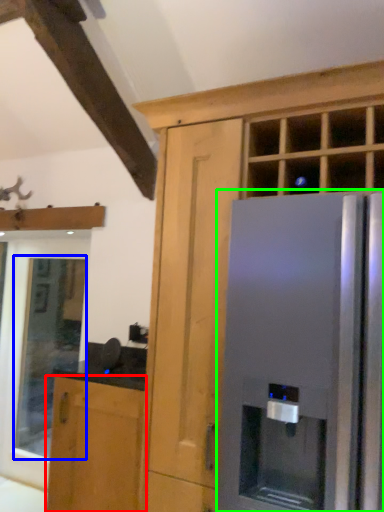
Question: Based on their relative distances, which object is nearer to cabinetry (highlighted by a red box)? Choose from window (highlighted by a blue box) and refrigerator (highlighted by a green box).

Choices:
 (A) window
 (B) refrigerator

Answer: (B)